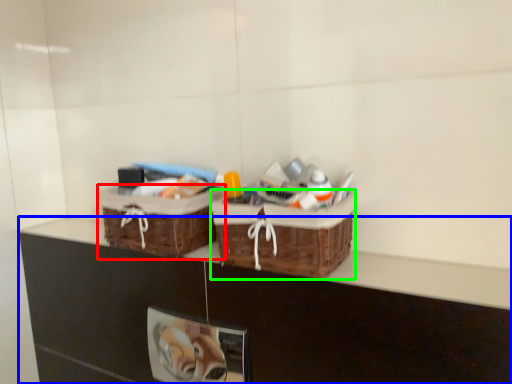
Question: Based on their relative distances, which object is nearer to picnic basket (highlighted by a red box)? Choose from counter (highlighted by a blue box) and picnic basket (highlighted by a green box).

Choices:
 (A) counter
 (B) picnic basket

Answer: (A)